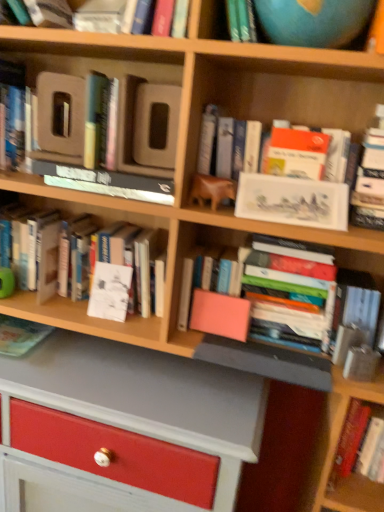
Question: Is white paper at center, arranged as the 3th paperback book when viewed from the front, inside or outside of hardcover book at lower right, which is counted as the 6th book, starting from the top?

Choices:
 (A) outside
 (B) inside

Answer: (A)

Question: Based on their sizes in the image, would you say white paper at center, arranged as the 1th paperback book when viewed from the left, is bigger or smaller than hardcover book at lower right, which is counted as the 6th book, starting from the top?

Choices:
 (A) small
 (B) big

Answer: (A)

Question: Considering the real-world distances, which object is closest to the matte white painting at upper right, which is the 1th paperback book in front-to-back order?

Choices:
 (A) white glossy book at upper center, acting as the second book starting from the top
 (B) white paper at center, the 2th paperback book viewed from the top
 (C) hardcover book at upper left, which appears as the third book when viewed from the top
 (D) hardcover book at lower right, the 1th book positioned from the bottom
 (E) matte green book at lower left, the fifth book in the top-to-bottom sequence

Answer: (A)

Question: Considering the real-world distances, which object is closest to the matte white painting at upper right, which is the first paperback book from right to left?

Choices:
 (A) hardcover book at upper left, the fourth book ordered from the bottom
 (B) white glossy book at upper center, the 5th book when ordered from bottom to top
 (C) white paper at center, positioned as the 1th paperback book in back-to-front order
 (D) white paper at center, the 3th book when ordered from bottom to top
 (E) blue matte globe at upper right

Answer: (B)